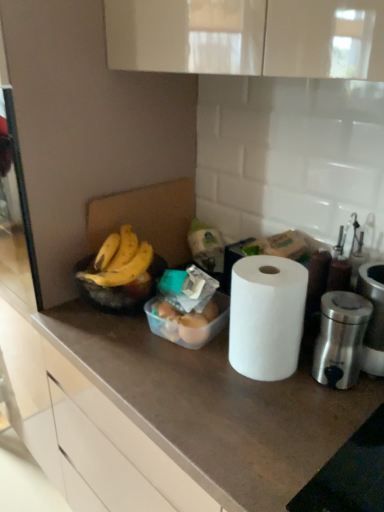
What do you see at coordinates (120, 260) in the screenshot? I see `yellow matte bananas at left` at bounding box center [120, 260].

Find the location of a particular element. The height and width of the screenshot is (512, 384). translucent plastic eggs at center is located at coordinates (188, 310).

Locate an element on the screen. polished stainless steel appliance at right is located at coordinates (340, 339).

This screenshot has height=512, width=384. What do you see at coordinates (266, 316) in the screenshot?
I see `white matte paper towel at center` at bounding box center [266, 316].

Where is `yellow matte bananas at left`? Image resolution: width=384 pixels, height=512 pixels. yellow matte bananas at left is located at coordinates (120, 260).

Can you tell me how much translucent plastic eggs at center and black plastic bowl at left differ in facing direction?

The facing directions of translucent plastic eggs at center and black plastic bowl at left are 0.000967 degrees apart.

Which of these two, translucent plastic eggs at center or black plastic bowl at left, stands taller?

black plastic bowl at left is taller.

Is translucent plastic eggs at center inside or outside of black plastic bowl at left?

The correct answer is: outside.

Is translucent plastic eggs at center not close to black plastic bowl at left?

Actually, translucent plastic eggs at center and black plastic bowl at left are a little close together.

Is polished stainless steel appliance at right far from yellow matte bananas at left?

polished stainless steel appliance at right is near yellow matte bananas at left, not far away.

Is polished stainless steel appliance at right wider or thinner than yellow matte bananas at left?

A: Considering their sizes, polished stainless steel appliance at right looks slimmer than yellow matte bananas at left.

What's the angular difference between polished stainless steel appliance at right and yellow matte bananas at left's facing directions?

The angular difference between polished stainless steel appliance at right and yellow matte bananas at left is 21.3 degrees.

Between polished stainless steel appliance at right and yellow matte bananas at left, which one has smaller size?

yellow matte bananas at left.

From a real-world perspective, relative to polished stainless steel appliance at right, is white matte countertop at center vertically above or below?

Clearly, from a real-world perspective, white matte countertop at center is below polished stainless steel appliance at right.

Does white matte countertop at center have a smaller size compared to polished stainless steel appliance at right?

Incorrect, white matte countertop at center is not smaller in size than polished stainless steel appliance at right.

Find the location of `countertop lying on the left of polished stainless steel appliance at right`. countertop lying on the left of polished stainless steel appliance at right is located at coordinates (213, 406).

From a real-world perspective, is white matte paper towel at center physically below yellow matte bananas at left?

Yes, from a real-world perspective, white matte paper towel at center is below yellow matte bananas at left.

Is white matte paper towel at center spatially inside yellow matte bananas at left, or outside of it?

white matte paper towel at center cannot be found inside yellow matte bananas at left.

Is white matte paper towel at center facing away from yellow matte bananas at left?

white matte paper towel at center does not have its back to yellow matte bananas at left.

Which object is positioned more to the left, white matte paper towel at center or yellow matte bananas at left?

From the viewer's perspective, yellow matte bananas at left appears more on the left side.

Is yellow matte bananas at left surrounding translucent plastic eggs at center?

No, translucent plastic eggs at center is not inside yellow matte bananas at left.

Which object is wider, yellow matte bananas at left or translucent plastic eggs at center?

translucent plastic eggs at center.

Is yellow matte bananas at left closer to camera compared to translucent plastic eggs at center?

That is False.

Is yellow matte bananas at left bigger than translucent plastic eggs at center?

Actually, yellow matte bananas at left might be smaller than translucent plastic eggs at center.

Considering the sizes of white matte paper towel at center and white matte countertop at center in the image, is white matte paper towel at center wider or thinner than white matte countertop at center?

In the image, white matte paper towel at center appears to be more narrow than white matte countertop at center.

How many degrees apart are the facing directions of white matte paper towel at center and white matte countertop at center?

0.69 degrees separate the facing orientations of white matte paper towel at center and white matte countertop at center.

Looking at the image, does white matte paper towel at center seem bigger or smaller compared to white matte countertop at center?

white matte paper towel at center is smaller than white matte countertop at center.

Does black plastic bowl at left have a greater width compared to translucent plastic eggs at center?

Indeed, black plastic bowl at left has a greater width compared to translucent plastic eggs at center.

Considering the relative positions of black plastic bowl at left and translucent plastic eggs at center in the image provided, is black plastic bowl at left to the left of translucent plastic eggs at center from the viewer's perspective?

Yes, black plastic bowl at left is to the left of translucent plastic eggs at center.

Between black plastic bowl at left and translucent plastic eggs at center, which one has larger size?

With larger size is black plastic bowl at left.

Is black plastic bowl at left positioned with its back to translucent plastic eggs at center?

No, translucent plastic eggs at center is not at the back of black plastic bowl at left.

This screenshot has height=512, width=384. Identify the location of food lying on the right of black plastic bowl at left. (188, 310).

At what (x,y) coordinates should I click in order to perform the action: click on banana lying behind the polished stainless steel appliance at right. Please return your answer as a coordinate pair (x, y). The height and width of the screenshot is (512, 384). Looking at the image, I should click on (120, 260).

Based on the photo, looking at the image, which one is located further to white matte paper towel at center, white matte countertop at center or polished stainless steel appliance at right?

white matte countertop at center is further to white matte paper towel at center.

Based on their spatial positions, is black plastic bowl at left or white matte paper towel at center closer to polished stainless steel appliance at right?

Based on the image, white matte paper towel at center appears to be nearer to polished stainless steel appliance at right.

Based on their spatial positions, is black plastic bowl at left or yellow matte bananas at left further from white matte countertop at center?

yellow matte bananas at left is positioned further to the anchor white matte countertop at center.

From the image, which object appears to be nearer to black plastic bowl at left, polished stainless steel appliance at right or yellow matte bananas at left?

yellow matte bananas at left.

Based on their spatial positions, is polished stainless steel appliance at right or white matte countertop at center closer to white matte paper towel at center?

polished stainless steel appliance at right is positioned closer to the anchor white matte paper towel at center.

Estimate the real-world distances between objects in this image. Which object is further from white matte paper towel at center, black plastic bowl at left or translucent plastic eggs at center?

black plastic bowl at left is further to white matte paper towel at center.

Considering their positions, is translucent plastic eggs at center positioned further to black plastic bowl at left than white matte paper towel at center?

The object further to black plastic bowl at left is white matte paper towel at center.

When comparing their distances from polished stainless steel appliance at right, does yellow matte bananas at left or white matte countertop at center seem further?

yellow matte bananas at left is further to polished stainless steel appliance at right.

This screenshot has width=384, height=512. What are the coordinates of `appliance between translucent plastic eggs at center and white matte countertop at center in the vertical direction` in the screenshot? It's located at 340,339.

Identify the location of paper towel between yellow matte bananas at left and polished stainless steel appliance at right in the horizontal direction. (266, 316).

You are a GUI agent. You are given a task and a screenshot of the screen. Output one action in this format:
    pyautogui.click(x=<x>, y=<y>)
    Task: Click on the banana between black plastic bowl at left and translucent plastic eggs at center in the horizontal direction
    This screenshot has width=384, height=512.
    Given the screenshot: What is the action you would take?
    pyautogui.click(x=120, y=260)

Locate an element on the screen. This screenshot has height=512, width=384. paper towel between black plastic bowl at left and polished stainless steel appliance at right in the horizontal direction is located at coordinates (266, 316).